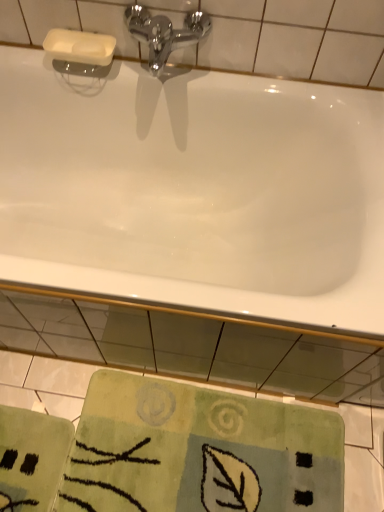
Question: Does white glossy bathtub at upper center have a lesser height compared to green textured rug at lower center?

Choices:
 (A) no
 (B) yes

Answer: (A)

Question: Are white glossy bathtub at upper center and green textured rug at lower center far apart?

Choices:
 (A) no
 (B) yes

Answer: (A)

Question: Is the position of white glossy bathtub at upper center less distant than that of green textured rug at lower center?

Choices:
 (A) yes
 (B) no

Answer: (A)

Question: Can you confirm if white glossy bathtub at upper center is bigger than green textured rug at lower center?

Choices:
 (A) yes
 (B) no

Answer: (A)

Question: Can you confirm if white glossy bathtub at upper center is taller than green textured rug at lower center?

Choices:
 (A) no
 (B) yes

Answer: (B)

Question: Does white glossy bathtub at upper center come behind green textured rug at lower center?

Choices:
 (A) yes
 (B) no

Answer: (B)

Question: Can you see white glossy bathtub at upper center touching chrome metallic faucet at upper center?

Choices:
 (A) yes
 (B) no

Answer: (B)

Question: Is white glossy bathtub at upper center shorter than chrome metallic faucet at upper center?

Choices:
 (A) yes
 (B) no

Answer: (B)

Question: Does white glossy bathtub at upper center lie behind chrome metallic faucet at upper center?

Choices:
 (A) no
 (B) yes

Answer: (A)

Question: Can you confirm if white glossy bathtub at upper center is smaller than chrome metallic faucet at upper center?

Choices:
 (A) yes
 (B) no

Answer: (B)

Question: From a real-world perspective, is white glossy bathtub at upper center physically above chrome metallic faucet at upper center?

Choices:
 (A) no
 (B) yes

Answer: (A)

Question: From the image's perspective, is white glossy bathtub at upper center below chrome metallic faucet at upper center?

Choices:
 (A) yes
 (B) no

Answer: (A)

Question: Is green textured rug at lower center far from chrome metallic faucet at upper center?

Choices:
 (A) yes
 (B) no

Answer: (A)